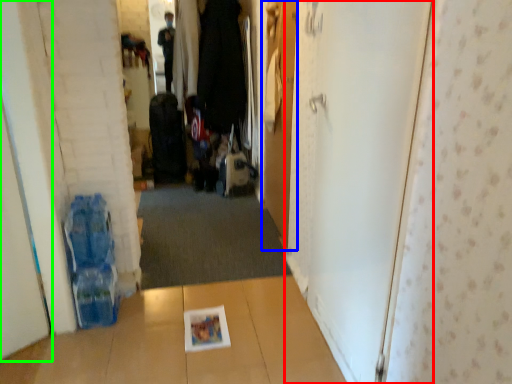
Question: Considering the real-world distances, which object is closest to door (highlighted by a red box)? door (highlighted by a blue box) or door (highlighted by a green box).

Choices:
 (A) door
 (B) door

Answer: (A)